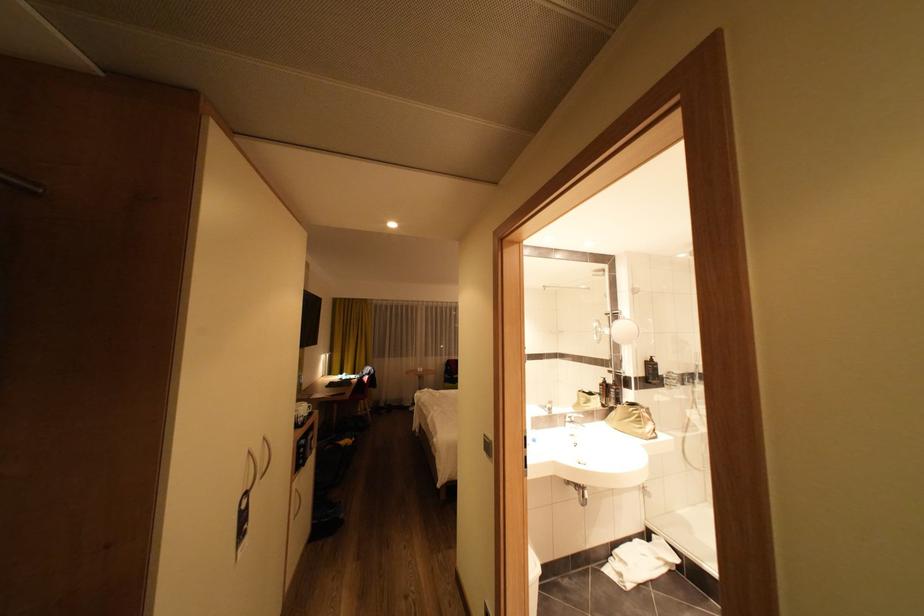
The image size is (924, 616). Identify the location of red chair sitting surface. (359, 399).